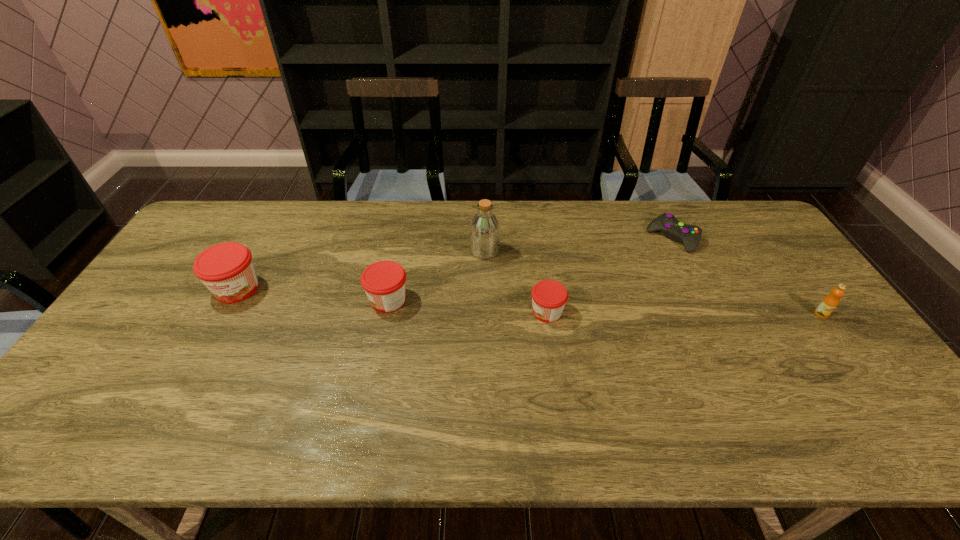
This screenshot has width=960, height=540. Identify the location of object that is the fourth closest to the tallest jam. (690, 235).

Identify the location of jam that is the nearest to the leftmost object. The height and width of the screenshot is (540, 960). (384, 282).

Where is `the closest jam to the shortest jam`? The image size is (960, 540). the closest jam to the shortest jam is located at coordinates (384, 282).

The image size is (960, 540). In order to click on free space in the image that satisfies the following two spatial constraints: 1. on the back side of the shortest object; 2. on the right side of the tallest object in this screenshot , I will do `click(485, 238)`.